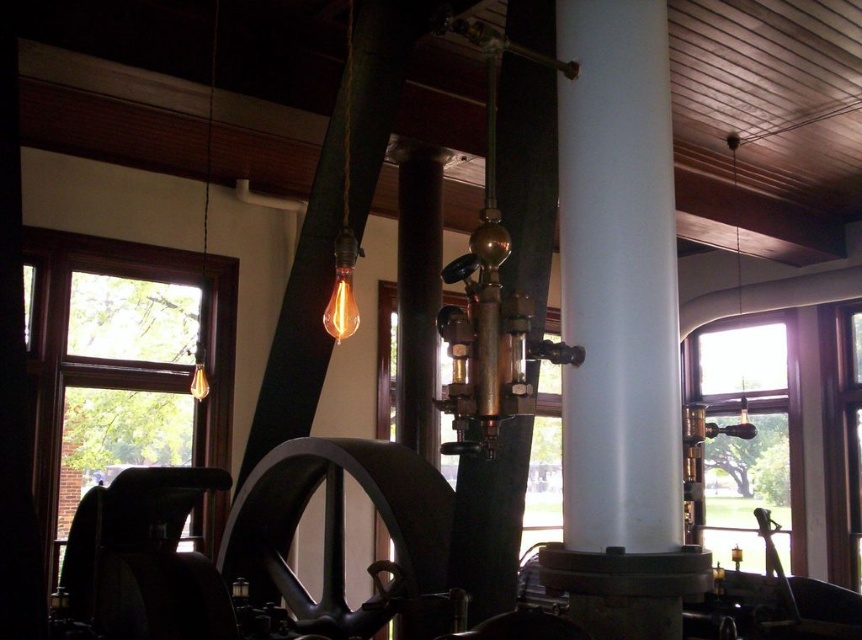
Question: Does white glossy pillar at center have a smaller size compared to clear glass window at right?

Choices:
 (A) no
 (B) yes

Answer: (B)

Question: Does white glossy pillar at center have a smaller size compared to clear glass window at left?

Choices:
 (A) no
 (B) yes

Answer: (B)

Question: Considering the relative positions of white glossy pillar at center and clear glass window at right in the image provided, where is white glossy pillar at center located with respect to clear glass window at right?

Choices:
 (A) right
 (B) left

Answer: (B)

Question: Which point is closer to the camera?

Choices:
 (A) (230, 378)
 (B) (798, 541)

Answer: (A)

Question: Which point is closer to the camera?

Choices:
 (A) white glossy pillar at center
 (B) clear glass window at right

Answer: (A)

Question: Based on their relative distances, which object is farther from the white glossy pillar at center?

Choices:
 (A) clear glass window at right
 (B) clear glass window at left

Answer: (A)